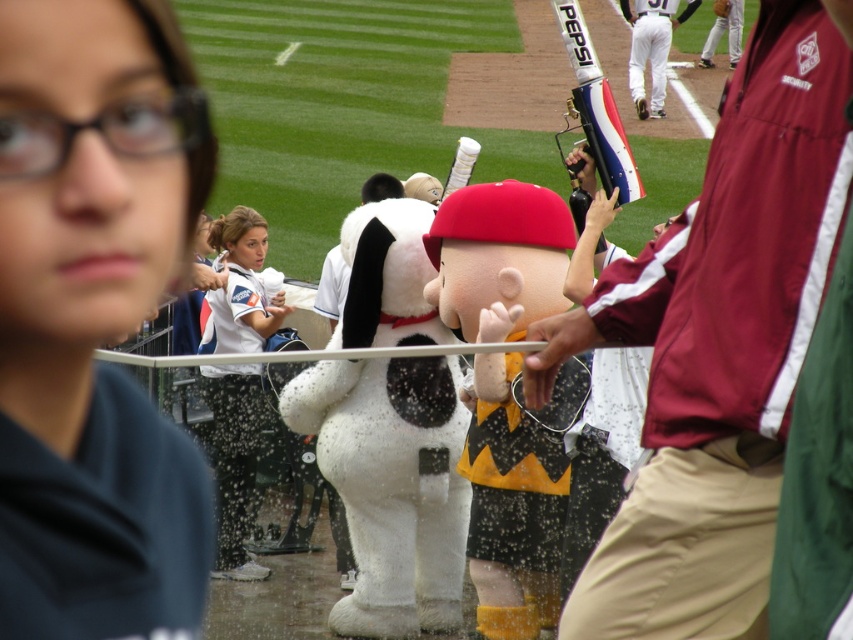
Does maroon security jacket at center appear on the left side of white fabric shirt at center?

No, maroon security jacket at center is not to the left of white fabric shirt at center.

Between maroon security jacket at center and white fabric shirt at center, which one is positioned higher?

maroon security jacket at center is above.

This screenshot has height=640, width=853. I want to click on maroon security jacket at center, so click(718, 344).

At what (x,y) coordinates should I click in order to perform the action: click on maroon security jacket at center. Please return your answer as a coordinate pair (x, y). Looking at the image, I should click on (718, 344).

How far apart are maroon security jacket at center and white plush dog at center?

maroon security jacket at center is 25.25 feet away from white plush dog at center.

This screenshot has height=640, width=853. Describe the element at coordinates (718, 344) in the screenshot. I see `maroon security jacket at center` at that location.

Locate an element on the screen. This screenshot has width=853, height=640. maroon security jacket at center is located at coordinates (718, 344).

Image resolution: width=853 pixels, height=640 pixels. What do you see at coordinates (94, 321) in the screenshot? I see `dark blue shirt at upper left` at bounding box center [94, 321].

Can you confirm if dark blue shirt at upper left is wider than white plush dog at center?

No.

Where is `dark blue shirt at upper left`? The height and width of the screenshot is (640, 853). dark blue shirt at upper left is located at coordinates (94, 321).